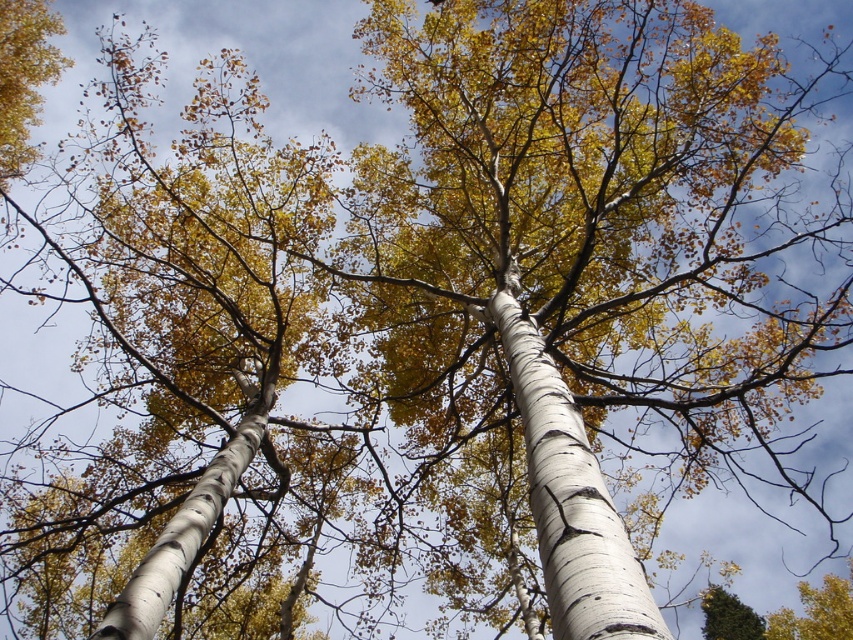
You are a bird trying to fly through the gap between the white bark birch tree at center and the white bark tree at center. Can you fit through the gap if your wingspan is 2 meters?

The gap between the white bark birch tree at center and the white bark tree at center is 2.85 meters, so yes, the bird can fit through the gap since its wingspan of 2 meters is narrower than the gap.

You are standing below two white bark trees in the forest. You notice a white bark birch tree at center and a white bark tree at center. Which one is positioned to the right?

The white bark birch tree at center is positioned to the right of the white bark tree at center.

You are standing under the aspen trees looking up. There are two points marked in the image, one at coordinates point (607, 12) and the other at point (41, 561). Which point is nearer to you?

Point (607, 12) is closer to the viewer than point (41, 561).